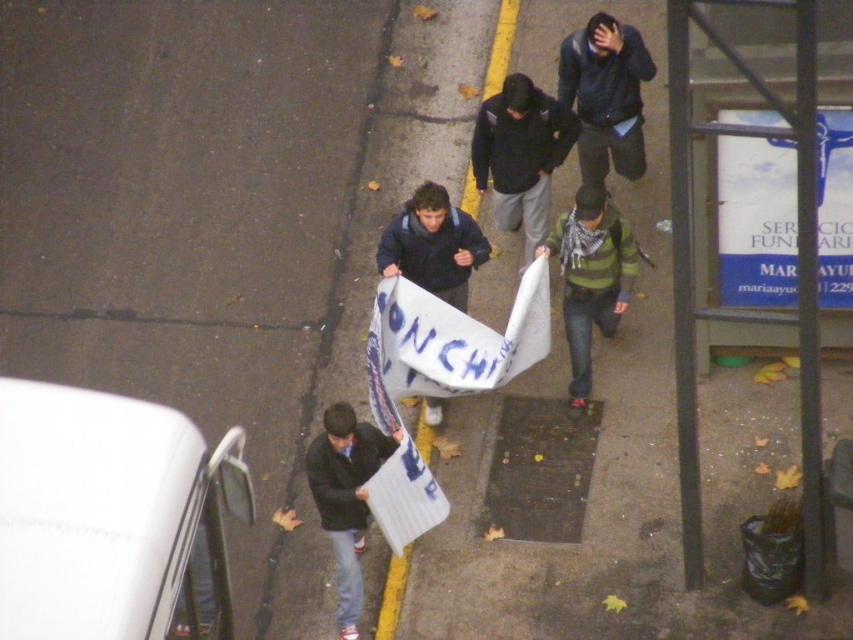
Question: Is dark blue jacket at upper center further to the viewer compared to green striped sweater at center?

Choices:
 (A) yes
 (B) no

Answer: (A)

Question: In this image, where is dark gray hoodie at center located relative to dark blue jacket at upper center?

Choices:
 (A) below
 (B) above

Answer: (A)

Question: Which is nearer to the dark blue jacket at upper center?

Choices:
 (A) dark gray hoodie at center
 (B) dark blue jacket at center
 (C) green striped sweater at center

Answer: (A)

Question: Which of the following is the farthest from the observer?

Choices:
 (A) dark gray hoodie at center
 (B) dark blue jacket at center
 (C) dark blue jacket at upper center
 (D) green striped sweater at center

Answer: (C)

Question: Is dark blue jacket at upper center further to the viewer compared to green striped sweater at center?

Choices:
 (A) yes
 (B) no

Answer: (A)

Question: Which of the following is the closest to the observer?

Choices:
 (A) (587, 136)
 (B) (572, 355)

Answer: (B)